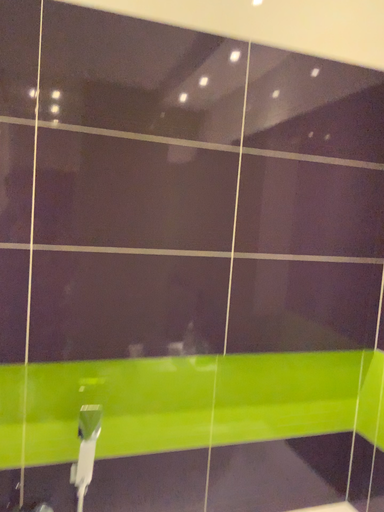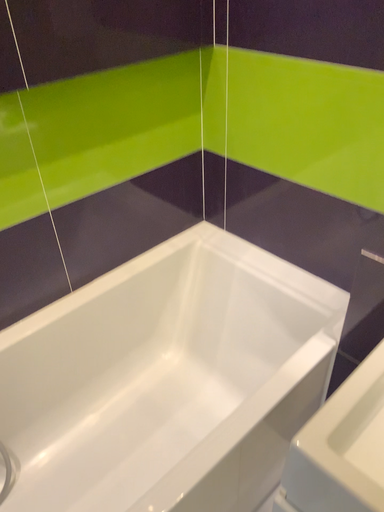
Question: Which way did the camera rotate in the video?

Choices:
 (A) rotated downward
 (B) rotated upward

Answer: (A)